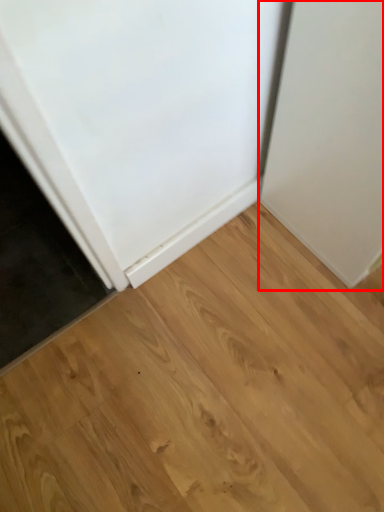
Question: Observing the image, what is the correct spatial positioning of door (annotated by the red box) in reference to hardwood?

Choices:
 (A) left
 (B) right

Answer: (B)